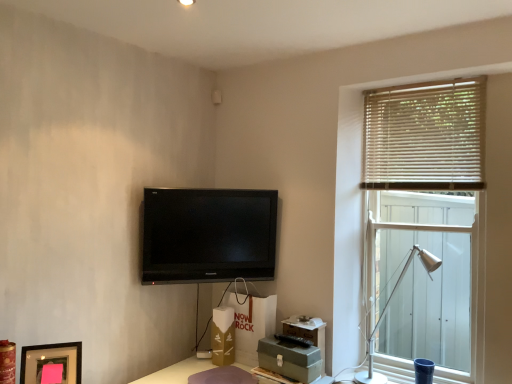
Question: Considering the relative sizes of wooden blinds at right and matte brown table at lower center in the image provided, is wooden blinds at right smaller than matte brown table at lower center?

Choices:
 (A) no
 (B) yes

Answer: (B)

Question: Is wooden blinds at right not close to matte brown table at lower center?

Choices:
 (A) no
 (B) yes

Answer: (B)

Question: From the image's perspective, does wooden blinds at right appear higher than matte brown table at lower center?

Choices:
 (A) yes
 (B) no

Answer: (A)

Question: Would you say matte brown table at lower center is part of wooden blinds at right's contents?

Choices:
 (A) no
 (B) yes

Answer: (A)

Question: Considering the relative sizes of wooden blinds at right and matte brown table at lower center in the image provided, is wooden blinds at right wider than matte brown table at lower center?

Choices:
 (A) no
 (B) yes

Answer: (A)

Question: Could you tell me if wooden blinds at right is turned towards matte brown table at lower center?

Choices:
 (A) no
 (B) yes

Answer: (A)

Question: Is matte black picture frame at lower left in contact with silver metallic table lamp at right?

Choices:
 (A) yes
 (B) no

Answer: (B)

Question: Could silver metallic table lamp at right be considered to be inside matte black picture frame at lower left?

Choices:
 (A) no
 (B) yes

Answer: (A)

Question: Can you confirm if matte black picture frame at lower left is smaller than silver metallic table lamp at right?

Choices:
 (A) yes
 (B) no

Answer: (A)

Question: Is matte black picture frame at lower left thinner than silver metallic table lamp at right?

Choices:
 (A) no
 (B) yes

Answer: (B)

Question: Is the position of matte black picture frame at lower left more distant than that of silver metallic table lamp at right?

Choices:
 (A) yes
 (B) no

Answer: (B)

Question: Considering the relative positions of matte black picture frame at lower left and silver metallic table lamp at right in the image provided, is matte black picture frame at lower left in front of silver metallic table lamp at right?

Choices:
 (A) yes
 (B) no

Answer: (A)

Question: Does black glossy tv at upper center appear on the right side of wooden blinds at right?

Choices:
 (A) no
 (B) yes

Answer: (A)